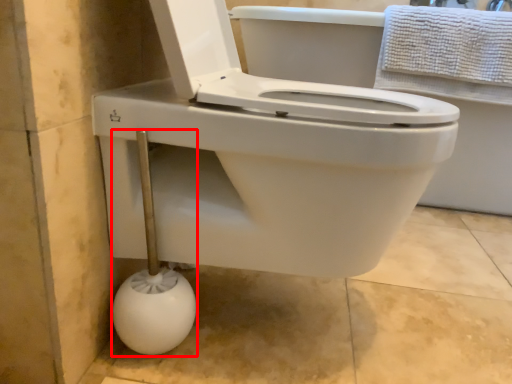
Question: From the image, what is the correct spatial relationship of shower (annotated by the red box) in relation to towel?

Choices:
 (A) left
 (B) right

Answer: (A)